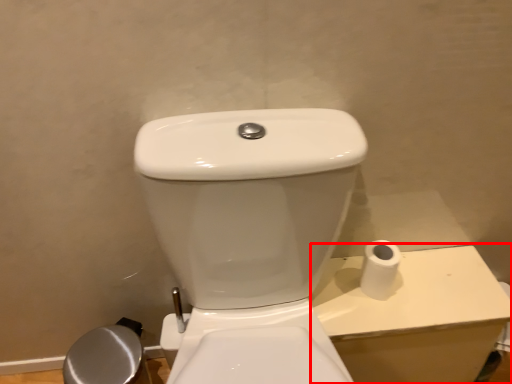
Question: From the image's perspective, where is porcelain (annotated by the red box) located relative to toilet paper?

Choices:
 (A) below
 (B) above

Answer: (A)